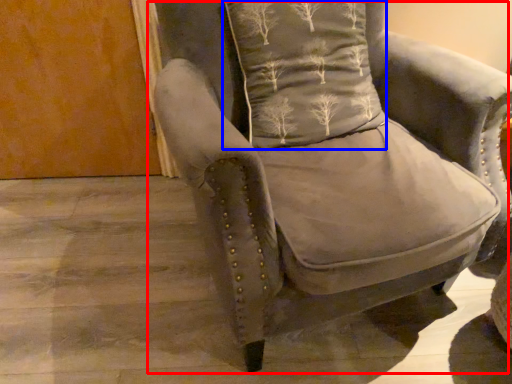
Question: Which object appears closest to the camera in this image, chair (highlighted by a red box) or pillow (highlighted by a blue box)?

Choices:
 (A) chair
 (B) pillow

Answer: (A)